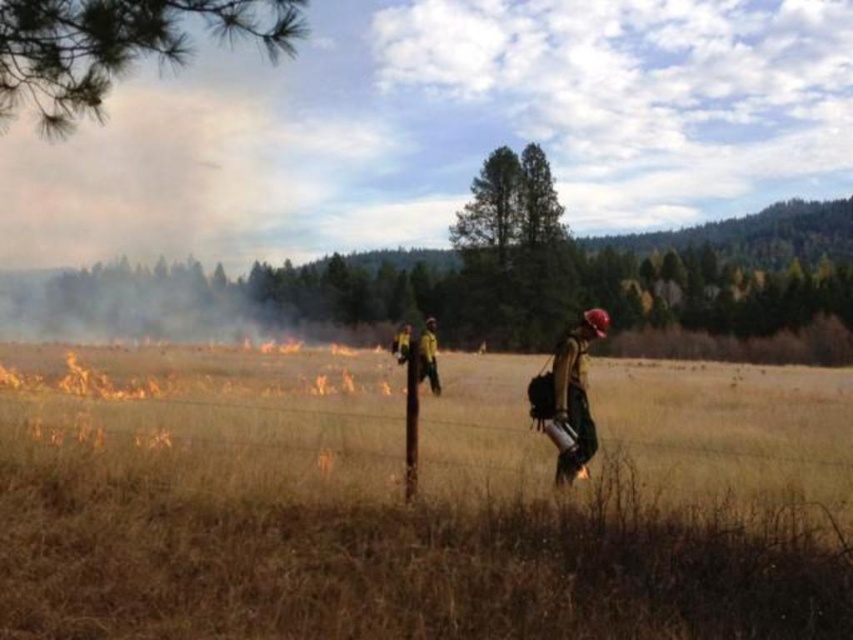
Which is behind, point (427, 332) or point (403, 356)?

Point (427, 332)

Between yellow-green uniform at center and yellow reflective vest at center, which one is positioned higher?

yellow-green uniform at center is above.

Where is `yellow-green uniform at center`? The width and height of the screenshot is (853, 640). yellow-green uniform at center is located at coordinates (428, 355).

Can you confirm if brown dry grass at center is smaller than yellow-green uniform at center?

No.

Does brown dry grass at center have a lesser height compared to yellow-green uniform at center?

No.

Which is in front, point (45, 612) or point (439, 381)?

Point (45, 612) is more forward.

You are a GUI agent. You are given a task and a screenshot of the screen. Output one action in this format:
    pyautogui.click(x=<x>, y=<y>)
    Task: Click on the brown dry grass at center
    
    Given the screenshot: What is the action you would take?
    pyautogui.click(x=416, y=500)

Measure the distance between matte brown helmet at right and yellow-green uniform at center.

They are 8.26 meters apart.

Which of these two, matte brown helmet at right or yellow-green uniform at center, stands taller?

With more height is yellow-green uniform at center.

Is point (556, 355) farther from camera compared to point (428, 316)?

No, (556, 355) is in front of (428, 316).

Where is `matte brown helmet at right`? matte brown helmet at right is located at coordinates (575, 392).